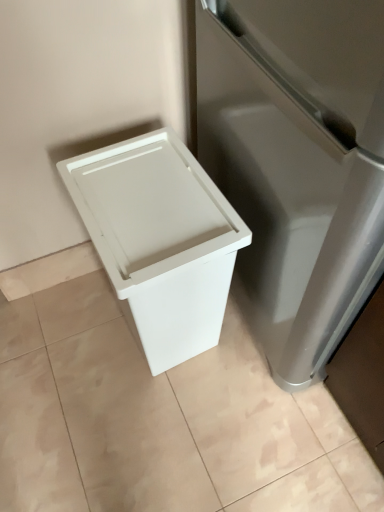
At what (x,y) coordinates should I click in order to perform the action: click on free space above white plastic trash can at lower left (from a real-world perspective). Please return your answer as a coordinate pair (x, y). This screenshot has height=512, width=384. Looking at the image, I should click on (155, 411).